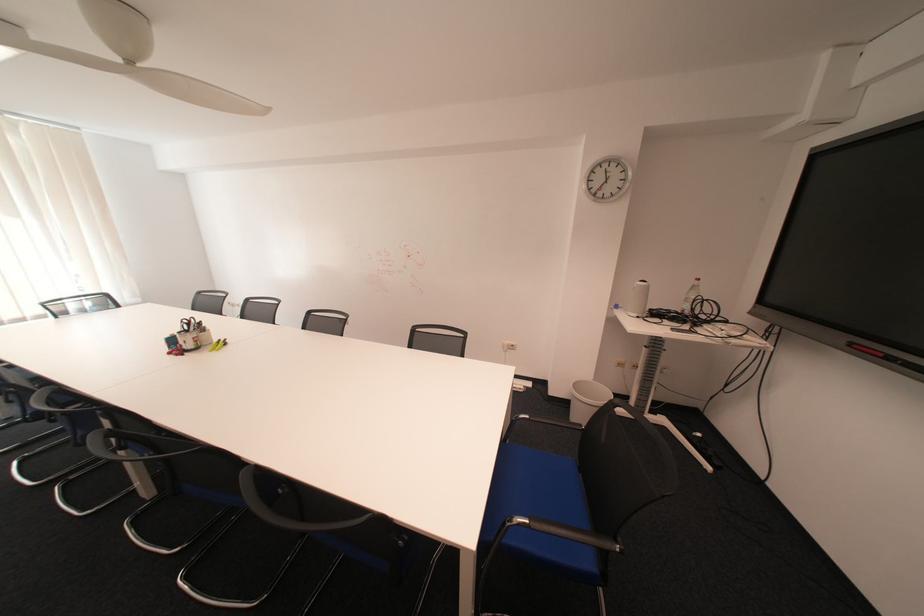
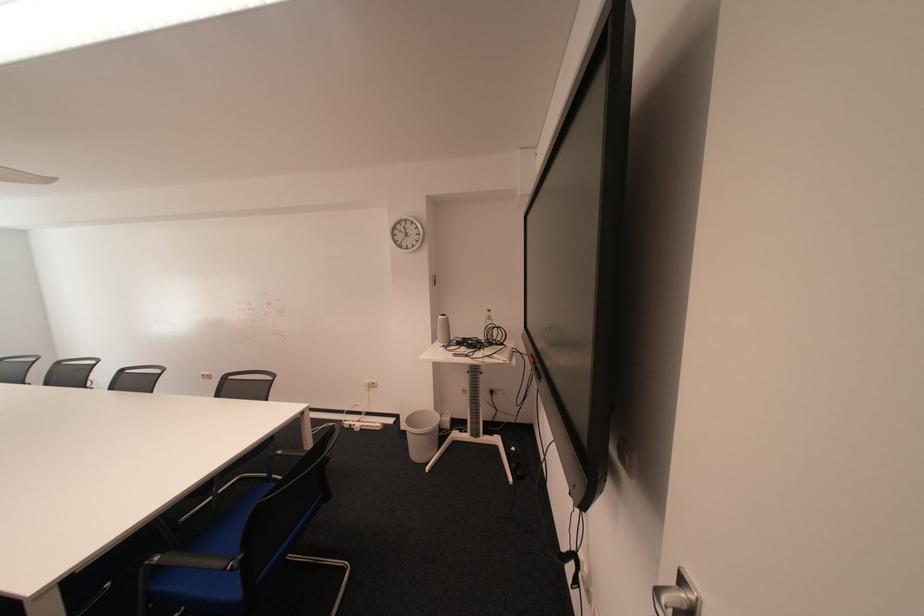
Question: Which direction would the cameraman need to move to produce the second image? Reply with the corresponding letter.

Choices:
 (A) Left
 (B) Right
 (C) Forward
 (D) Backward

Answer: (B)